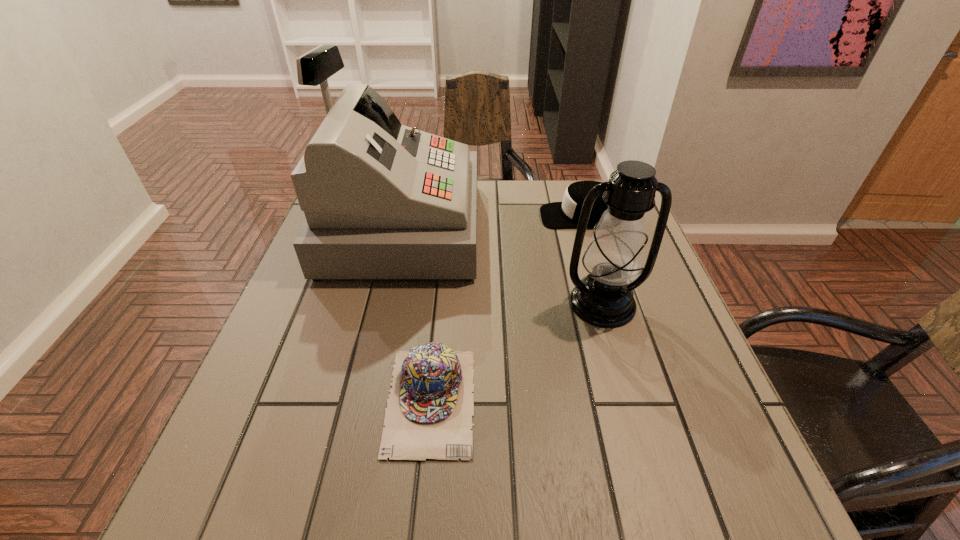
Identify the location of cash register. This screenshot has width=960, height=540. (382, 200).

The width and height of the screenshot is (960, 540). In order to click on oil lamp in this screenshot , I will do `click(614, 257)`.

Where is `the right cap`? the right cap is located at coordinates (554, 215).

Find the location of a particular element. Image resolution: width=960 pixels, height=540 pixels. the farther cap is located at coordinates (554, 215).

At what (x,y) coordinates should I click in order to perform the action: click on the shorter cap. Please return your answer as a coordinate pair (x, y). Image resolution: width=960 pixels, height=540 pixels. Looking at the image, I should click on (429, 412).

The width and height of the screenshot is (960, 540). Find the location of `the nearest object`. the nearest object is located at coordinates (429, 412).

I want to click on vacant space situated on the keypad side of the tallest object, so (559, 228).

Find the location of `free space located on the back of the oil lamp`. free space located on the back of the oil lamp is located at coordinates (584, 238).

Find the location of a particular element. This screenshot has width=960, height=540. vacant space situated 0.320m on the front-facing side of the third tallest object is located at coordinates (425, 216).

Where is `vacant space situated 0.110m on the front-facing side of the third tallest object`? The image size is (960, 540). vacant space situated 0.110m on the front-facing side of the third tallest object is located at coordinates (500, 216).